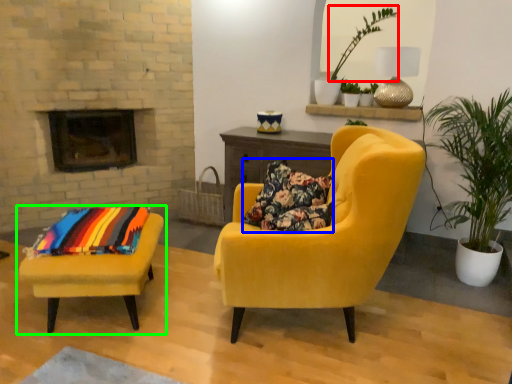
Question: Which is nearer to the plant (highlighted by a red box)? pillow (highlighted by a blue box) or chair (highlighted by a green box).

Choices:
 (A) pillow
 (B) chair

Answer: (A)